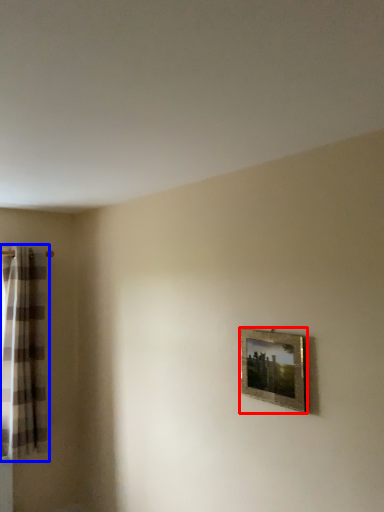
Question: Which object is closer to the camera taking this photo, picture frame (highlighted by a red box) or curtain (highlighted by a blue box)?

Choices:
 (A) picture frame
 (B) curtain

Answer: (A)